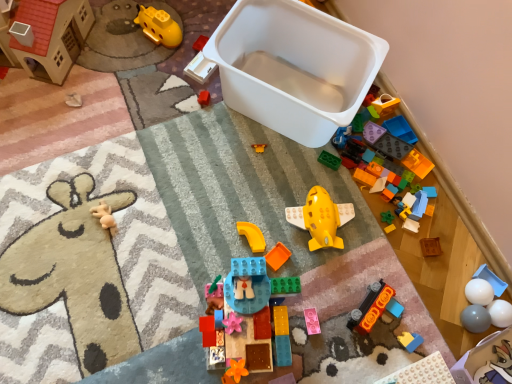
The height and width of the screenshot is (384, 512). I want to click on free space between white plastic tray at upper center, placed as the 13th toy when sorted from right to left, and translucent blue plastic building block at center, the 12th toy from the right, so click(222, 193).